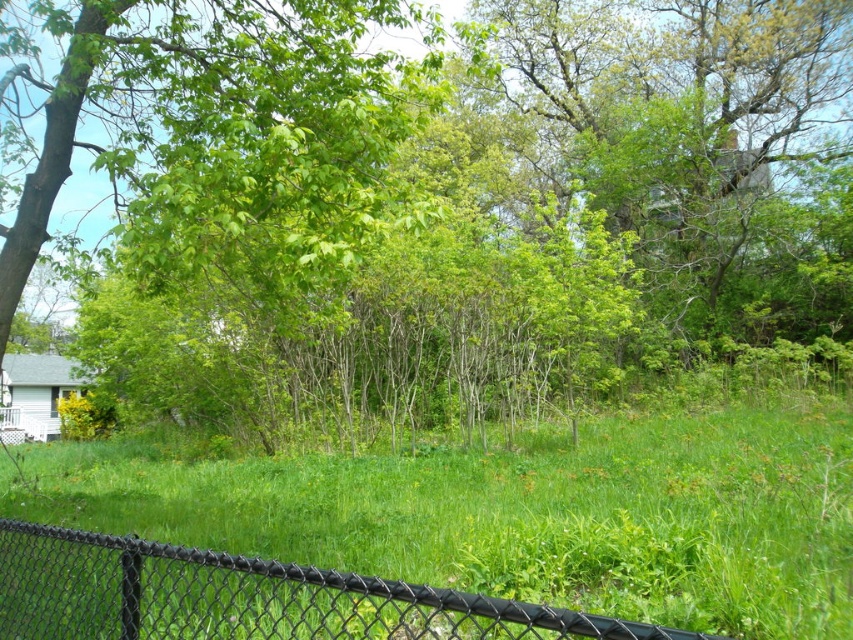
In the scene shown: You are standing at the bottom of the image and want to walk towards the green grassy at center. According to the coordinates provided, in which direction should you move to reach it?

The green grassy at center is located at coordinates point [515,513]. Since you are at the bottom of the image, moving upwards would bring you closer to the green grassy at center.